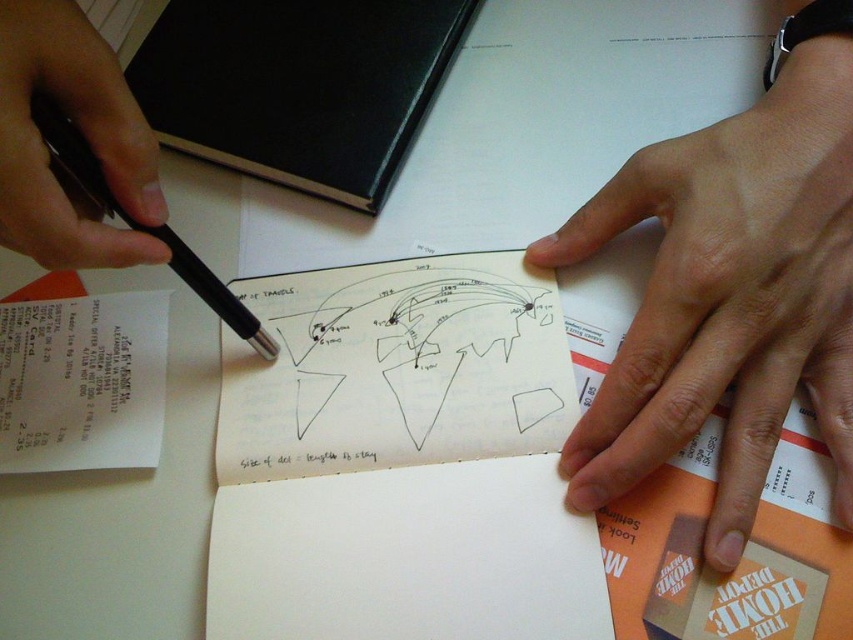
Does black paper at center appear over black metallic pen at left?

Incorrect, black paper at center is not positioned above black metallic pen at left.

From the picture: Which of these two, black paper at center or black metallic pen at left, stands shorter?

black metallic pen at left

Is point (238, 356) positioned after point (35, 115)?

That is True.

The image size is (853, 640). What are the coordinates of `black paper at center` in the screenshot? It's located at (395, 369).

Is smooth skin hand at lower right taller than black paper at center?

Indeed, smooth skin hand at lower right has a greater height compared to black paper at center.

The height and width of the screenshot is (640, 853). Identify the location of smooth skin hand at lower right. (724, 305).

Is smooth skin hand at lower right further to camera compared to black pen at upper left?

Yes.

Between point (740, 170) and point (28, 164), which one is positioned behind?

Point (740, 170)

Locate an element on the screen. Image resolution: width=853 pixels, height=640 pixels. smooth skin hand at lower right is located at coordinates (724, 305).